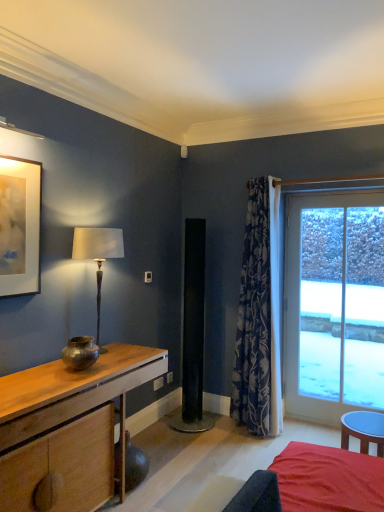
Identify the location of empty space that is ontop of transparent glass door at right (from a real-world perspective). The height and width of the screenshot is (512, 384). (336, 192).